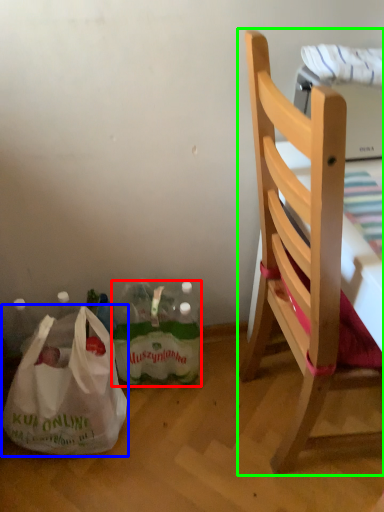
Question: Which object is positioned closest to bottle (highlighted by a red box)? Select from plastic bag (highlighted by a blue box) and chair (highlighted by a green box).

Choices:
 (A) plastic bag
 (B) chair

Answer: (A)